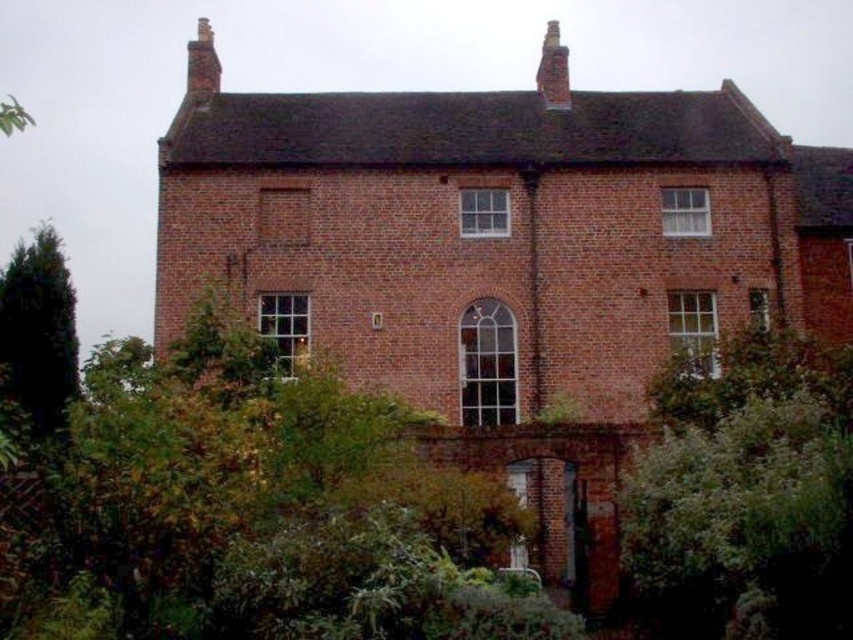
Question: Which is nearer to the red brick chimney at upper center?

Choices:
 (A) red brick chimney at upper left
 (B) green leafy tree at left

Answer: (A)

Question: Which point is farther to the camera?

Choices:
 (A) (67, 378)
 (B) (199, 22)

Answer: (B)

Question: Can you confirm if green leafy tree at left is positioned below red brick chimney at upper left?

Choices:
 (A) yes
 (B) no

Answer: (A)

Question: Can you confirm if green leafy tree at left is positioned to the right of red brick chimney at upper center?

Choices:
 (A) no
 (B) yes

Answer: (A)

Question: Which object is closer to the camera taking this photo?

Choices:
 (A) red brick chimney at upper center
 (B) green leafy tree at left
 (C) red brick chimney at upper left

Answer: (B)

Question: Can you confirm if green leafy tree at left is thinner than red brick chimney at upper center?

Choices:
 (A) no
 (B) yes

Answer: (A)